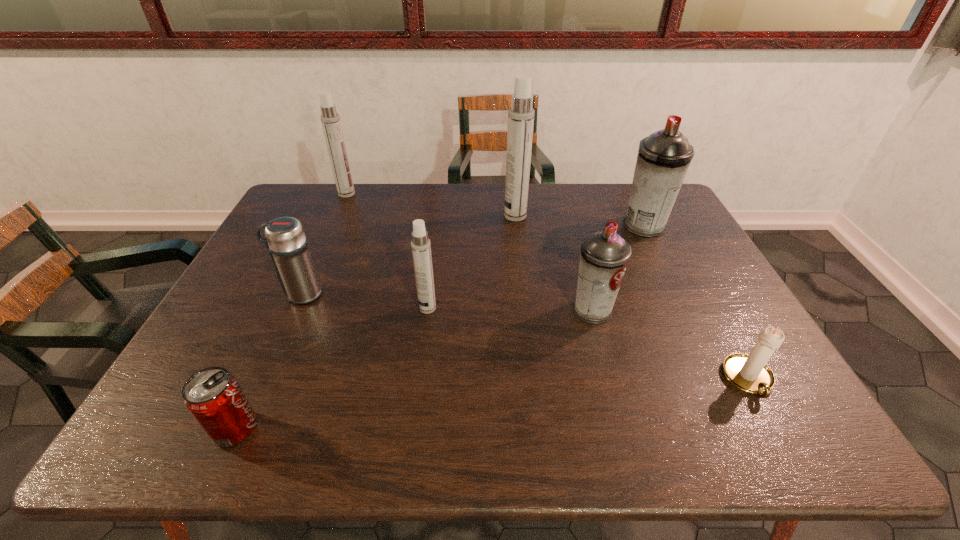
Find the location of `the third closest white aerosol can to the thermos bottle`. the third closest white aerosol can to the thermos bottle is located at coordinates (521, 114).

Find the location of a particular element. The width and height of the screenshot is (960, 540). vacant space that satisfies the following two spatial constraints: 1. on the front side of the nearest white aerosol can; 2. on the right side of the second smallest white aerosol can is located at coordinates (297, 308).

The image size is (960, 540). What are the coordinates of `free space that satisfies the following two spatial constraints: 1. with a handle on the side of the sixth tallest object; 2. on the back side of the second aerosol can from right to left` in the screenshot? It's located at (294, 310).

You are a GUI agent. You are given a task and a screenshot of the screen. Output one action in this format:
    pyautogui.click(x=<x>, y=<y>)
    Task: Click on the vacant region that satisfies the following two spatial constraints: 1. with a handle on the side of the thermos bottle; 2. on the right side of the left gray aerosol can
    
    Given the screenshot: What is the action you would take?
    pyautogui.click(x=294, y=310)